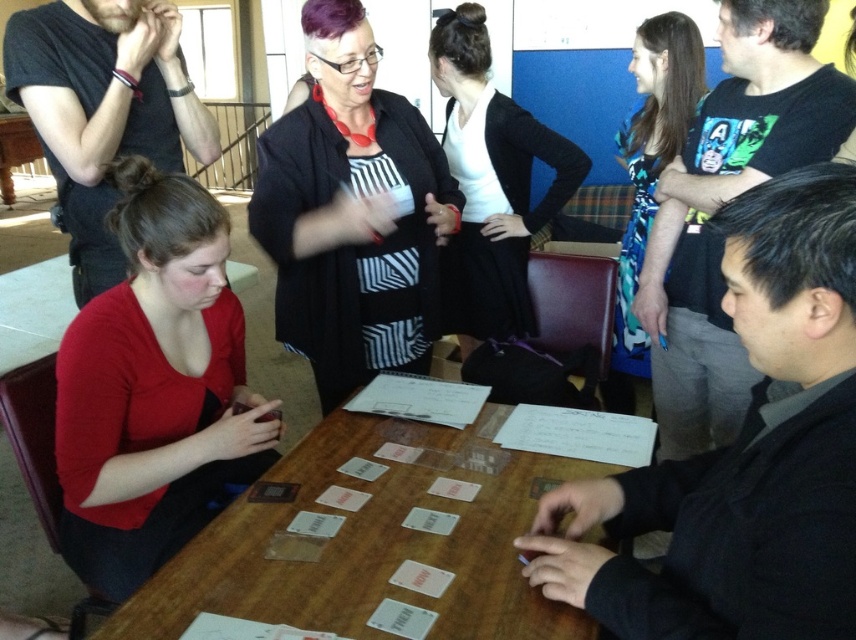
You are standing in front of the wooden table where the group is gathered. You want to pick up the matte red shirt at lower left. Is it within your reach without moving your feet?

The matte red shirt at lower left is 1.29 meters away from viewer. Since the average arm reach is about 1 meter, you would need to take a step forward to reach it.

You are standing at the origin point of the coordinate system, which is the bottom left corner of the image. The table is located in front of you. Where is the matte red shirt at lower left positioned relative to the coordinate system?

The matte red shirt at lower left is positioned at point 0.609 on the x axis and 0.182 on the y axis relative to the coordinate system.

You are a delivery person who needs to place a small package between the matte red shirt at lower left and the black knit cardigan at center on the table. The package is 1.2 meters long. Will it fit between them?

The distance between the matte red shirt at lower left and the black knit cardigan at center is 1.15 meters. Since the package is 1.2 meters long, it will not fit between them as the distance is shorter than the package length.